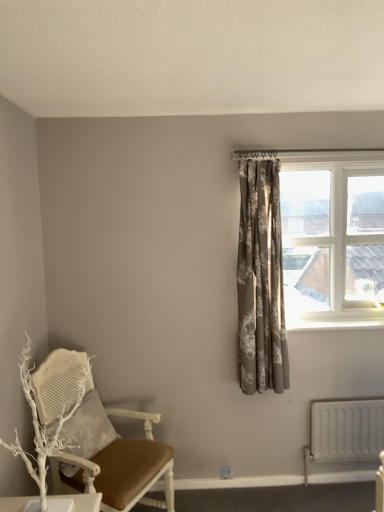
Question: From their relative heights in the image, would you say white painted wood at upper right is taller or shorter than silvery-grey floral curtain at upper right?

Choices:
 (A) short
 (B) tall

Answer: (A)

Question: In terms of width, does white painted wood at upper right look wider or thinner when compared to silvery-grey floral curtain at upper right?

Choices:
 (A) thin
 (B) wide

Answer: (A)

Question: Considering the real-world distances, which object is farthest from the silvery-grey floral curtain at upper right?

Choices:
 (A) white matte branch at lower left
 (B) white painted wood chair at left
 (C) white plastic window at upper right
 (D) white matte radiator at lower right
 (E) white painted wood at upper right

Answer: (A)

Question: Estimate the real-world distances between objects in this image. Which object is farther from the white matte radiator at lower right?

Choices:
 (A) white plastic window at upper right
 (B) white textured pillow at lower left
 (C) white matte branch at lower left
 (D) white painted wood chair at left
 (E) silvery-grey floral curtain at upper right

Answer: (C)